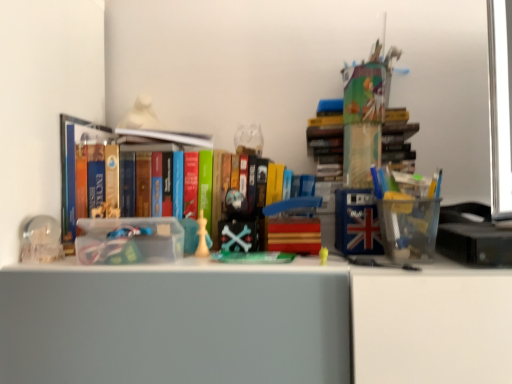
Question: Is the depth of matte white bust at upper center, the 5th toy ordered from the bottom, greater than that of yellow matte toy at center, positioned as the 5th toy in back-to-front order?

Choices:
 (A) no
 (B) yes

Answer: (B)

Question: Does matte white bust at upper center, arranged as the 5th toy when viewed from the right, have a lesser width compared to yellow matte toy at center, arranged as the 1th toy when viewed from the right?

Choices:
 (A) no
 (B) yes

Answer: (A)

Question: Is matte white bust at upper center, arranged as the 1th toy when viewed from the back, at the left side of yellow matte toy at center, acting as the fifth toy starting from the left?

Choices:
 (A) yes
 (B) no

Answer: (A)

Question: Is the position of matte white bust at upper center, arranged as the 5th toy when viewed from the right, less distant than that of yellow matte toy at center, arranged as the 1th toy when viewed from the right?

Choices:
 (A) yes
 (B) no

Answer: (B)

Question: Considering the relative sizes of matte white bust at upper center, which ranks as the first toy in top-to-bottom order, and yellow matte toy at center, arranged as the first toy when viewed from the front, in the image provided, is matte white bust at upper center, which ranks as the first toy in top-to-bottom order, taller than yellow matte toy at center, arranged as the first toy when viewed from the front,?

Choices:
 (A) no
 (B) yes

Answer: (B)

Question: Does matte white bust at upper center, which appears as the first toy when viewed from the left, have a smaller size compared to yellow matte toy at center, positioned as the 5th toy in back-to-front order?

Choices:
 (A) no
 (B) yes

Answer: (A)

Question: Could you tell me if matte white bust at upper center, which ranks as the first toy in top-to-bottom order, is facing shiny plastic skull at center, positioned as the 2th toy in back-to-front order?

Choices:
 (A) yes
 (B) no

Answer: (B)

Question: Does matte white bust at upper center, the 5th toy ordered from the bottom, come behind shiny plastic skull at center, the second toy viewed from the top?

Choices:
 (A) yes
 (B) no

Answer: (A)

Question: Is the position of matte white bust at upper center, which ranks as the first toy in top-to-bottom order, less distant than that of shiny plastic skull at center, the 4th toy when ordered from front to back?

Choices:
 (A) no
 (B) yes

Answer: (A)

Question: Does matte white bust at upper center, arranged as the 5th toy when viewed from the right, have a lesser width compared to shiny plastic skull at center, acting as the 3th toy starting from the right?

Choices:
 (A) yes
 (B) no

Answer: (B)

Question: From the image's perspective, does matte white bust at upper center, which ranks as the first toy in top-to-bottom order, appear lower than shiny plastic skull at center, positioned as the 2th toy in back-to-front order?

Choices:
 (A) no
 (B) yes

Answer: (A)

Question: Are matte white bust at upper center, the 5th toy ordered from the bottom, and shiny plastic skull at center, the 4th toy when ordered from front to back, located far from each other?

Choices:
 (A) no
 (B) yes

Answer: (A)

Question: Does clear plastic container at left have a greater height compared to wooden block at center, placed as the 3th toy when sorted from top to bottom?

Choices:
 (A) yes
 (B) no

Answer: (A)